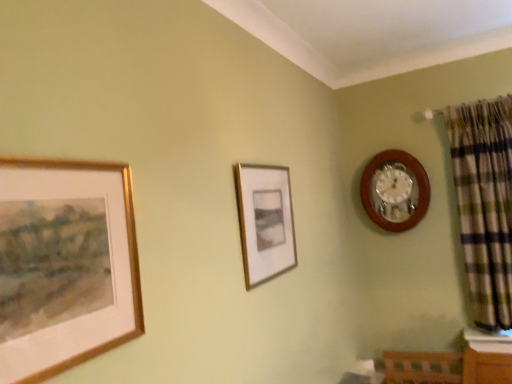
Where is `matte gold picture frame at center, the 1th picture frame positioned from the back`? Image resolution: width=512 pixels, height=384 pixels. matte gold picture frame at center, the 1th picture frame positioned from the back is located at coordinates (265, 221).

The image size is (512, 384). Identify the location of wooden wall clock at upper right. (395, 189).

Measure the distance between point (378, 155) and camera.

The depth of point (378, 155) is 8.89 feet.

This screenshot has height=384, width=512. I want to click on green plaid fabric at right, so click(x=484, y=203).

Locate an element on the screen. The height and width of the screenshot is (384, 512). matte gold picture frame at center, arranged as the 2th picture frame when viewed from the front is located at coordinates (265, 221).

Is wooden wall clock at upper right situated inside matte gold picture frame at center, positioned as the second picture frame in left-to-right order, or outside?

wooden wall clock at upper right is located beyond the bounds of matte gold picture frame at center, positioned as the second picture frame in left-to-right order.

Who is more distant, wooden wall clock at upper right or matte gold picture frame at center, marked as the 1th picture frame in a right-to-left arrangement?

Positioned behind is wooden wall clock at upper right.

From the image's perspective, which one is positioned lower, wooden wall clock at upper right or matte gold picture frame at center, marked as the 1th picture frame in a right-to-left arrangement?

matte gold picture frame at center, marked as the 1th picture frame in a right-to-left arrangement.

From a real-world perspective, is wooden wall clock at upper right positioned over matte gold picture frame at center, marked as the 1th picture frame in a right-to-left arrangement, based on gravity?

Correct, in the physical world, wooden wall clock at upper right is higher than matte gold picture frame at center, marked as the 1th picture frame in a right-to-left arrangement.

How different are the orientations of wooden wall clock at upper right and green plaid fabric at right in degrees?

There is a 0.973-degree angle between the facing directions of wooden wall clock at upper right and green plaid fabric at right.

Considering the positions of objects wooden wall clock at upper right and green plaid fabric at right in the image provided, who is behind, wooden wall clock at upper right or green plaid fabric at right?

wooden wall clock at upper right is more distant.

Would you consider wooden wall clock at upper right to be distant from green plaid fabric at right?

They are positioned close to each other.

From a real-world perspective, is matte gold picture frame at center, marked as the 1th picture frame in a right-to-left arrangement, on top of wooden wall clock at upper right?

No, from a real-world perspective, matte gold picture frame at center, marked as the 1th picture frame in a right-to-left arrangement, is not on top of wooden wall clock at upper right.

Starting from the wooden wall clock at upper right, which picture frame is the 1st one in front? Please provide its 2D coordinates.

[(265, 221)]

Based on the photo, from the image's perspective, which is below, matte gold picture frame at center, positioned as the second picture frame in left-to-right order, or wooden wall clock at upper right?

matte gold picture frame at center, positioned as the second picture frame in left-to-right order, is shown below in the image.

Does matte gold picture frame at center, arranged as the 2th picture frame when viewed from the front, touch wooden wall clock at upper right?

No.

Is wooden wall clock at upper right not close to gold-framed painting at left, the second picture frame in the right-to-left sequence?

wooden wall clock at upper right is positioned a significant distance from gold-framed painting at left, the second picture frame in the right-to-left sequence.

Does wooden wall clock at upper right contain gold-framed painting at left, which is the second picture frame from back to front?

No, gold-framed painting at left, which is the second picture frame from back to front, is not inside wooden wall clock at upper right.

Is the depth of wooden wall clock at upper right greater than that of gold-framed painting at left, the 1th picture frame when ordered from left to right?

Yes, it is.

From a real-world perspective, which is physically above, wooden wall clock at upper right or gold-framed painting at left, the 1th picture frame when ordered from left to right?

wooden wall clock at upper right.

Is gold-framed painting at left, which ranks as the 1th picture frame in front-to-back order, behind matte gold picture frame at center, positioned as the second picture frame in left-to-right order?

No, gold-framed painting at left, which ranks as the 1th picture frame in front-to-back order, is in front of matte gold picture frame at center, positioned as the second picture frame in left-to-right order.

Is gold-framed painting at left, the second picture frame in the right-to-left sequence, wider than matte gold picture frame at center, positioned as the second picture frame in left-to-right order?

No, gold-framed painting at left, the second picture frame in the right-to-left sequence, is not wider than matte gold picture frame at center, positioned as the second picture frame in left-to-right order.

Is matte gold picture frame at center, marked as the 1th picture frame in a right-to-left arrangement, inside gold-framed painting at left, which is the second picture frame from back to front?

That's incorrect, matte gold picture frame at center, marked as the 1th picture frame in a right-to-left arrangement, is not inside gold-framed painting at left, which is the second picture frame from back to front.

From the image's perspective, is gold-framed painting at left, the 1th picture frame when ordered from left to right, under matte gold picture frame at center, arranged as the 2th picture frame when viewed from the front?

Indeed, from the image's perspective, gold-framed painting at left, the 1th picture frame when ordered from left to right, is shown beneath matte gold picture frame at center, arranged as the 2th picture frame when viewed from the front.

Would you say green plaid fabric at right is inside or outside gold-framed painting at left, which is the second picture frame from back to front?

green plaid fabric at right exists outside the volume of gold-framed painting at left, which is the second picture frame from back to front.

From the image's perspective, which one is positioned higher, green plaid fabric at right or gold-framed painting at left, the second picture frame in the right-to-left sequence?

green plaid fabric at right.

Is green plaid fabric at right with gold-framed painting at left, the second picture frame in the right-to-left sequence?

They are not placed beside each other.

This screenshot has width=512, height=384. I want to click on curtain below the gold-framed painting at left, the 1th picture frame when ordered from left to right (from a real-world perspective), so click(x=484, y=203).

Considering their positions, is matte gold picture frame at center, the 1th picture frame positioned from the back, located in front of or behind gold-framed painting at left, the second picture frame in the right-to-left sequence?

matte gold picture frame at center, the 1th picture frame positioned from the back, is behind gold-framed painting at left, the second picture frame in the right-to-left sequence.

Based on the photo, is matte gold picture frame at center, positioned as the second picture frame in left-to-right order, bigger than gold-framed painting at left, the 1th picture frame when ordered from left to right?

Correct, matte gold picture frame at center, positioned as the second picture frame in left-to-right order, is larger in size than gold-framed painting at left, the 1th picture frame when ordered from left to right.

Does matte gold picture frame at center, arranged as the 2th picture frame when viewed from the front, appear on the left side of gold-framed painting at left, which ranks as the 1th picture frame in front-to-back order?

In fact, matte gold picture frame at center, arranged as the 2th picture frame when viewed from the front, is to the right of gold-framed painting at left, which ranks as the 1th picture frame in front-to-back order.

Where is `wall clock above the matte gold picture frame at center, arranged as the 2th picture frame when viewed from the front (from the image's perspective)`? The width and height of the screenshot is (512, 384). wall clock above the matte gold picture frame at center, arranged as the 2th picture frame when viewed from the front (from the image's perspective) is located at coordinates (395, 189).

Locate an element on the screen. curtain in front of the wooden wall clock at upper right is located at coordinates (484, 203).

In the scene shown: Based on their spatial positions, is gold-framed painting at left, the second picture frame in the right-to-left sequence, or green plaid fabric at right closer to matte gold picture frame at center, the 1th picture frame positioned from the back?

Among the two, gold-framed painting at left, the second picture frame in the right-to-left sequence, is located nearer to matte gold picture frame at center, the 1th picture frame positioned from the back.

Considering their positions, is matte gold picture frame at center, marked as the 1th picture frame in a right-to-left arrangement, positioned closer to wooden wall clock at upper right than gold-framed painting at left, the second picture frame in the right-to-left sequence?

matte gold picture frame at center, marked as the 1th picture frame in a right-to-left arrangement, is positioned closer to the anchor wooden wall clock at upper right.

Based on their spatial positions, is matte gold picture frame at center, positioned as the second picture frame in left-to-right order, or gold-framed painting at left, the second picture frame in the right-to-left sequence, closer to green plaid fabric at right?

Based on the image, matte gold picture frame at center, positioned as the second picture frame in left-to-right order, appears to be nearer to green plaid fabric at right.

When comparing their distances from matte gold picture frame at center, the 1th picture frame positioned from the back, does gold-framed painting at left, which is the second picture frame from back to front, or wooden wall clock at upper right seem further?

wooden wall clock at upper right lies further to matte gold picture frame at center, the 1th picture frame positioned from the back, than the other object.

From the image, which object appears to be nearer to gold-framed painting at left, the second picture frame in the right-to-left sequence, green plaid fabric at right or matte gold picture frame at center, the 1th picture frame positioned from the back?

matte gold picture frame at center, the 1th picture frame positioned from the back, is closer to gold-framed painting at left, the second picture frame in the right-to-left sequence.

Which object lies further to the anchor point green plaid fabric at right, matte gold picture frame at center, the 1th picture frame positioned from the back, or wooden wall clock at upper right?

matte gold picture frame at center, the 1th picture frame positioned from the back, lies further to green plaid fabric at right than the other object.

Which object lies nearer to the anchor point wooden wall clock at upper right, gold-framed painting at left, which ranks as the 1th picture frame in front-to-back order, or matte gold picture frame at center, the 1th picture frame positioned from the back?

matte gold picture frame at center, the 1th picture frame positioned from the back, lies closer to wooden wall clock at upper right than the other object.

Looking at the image, which one is located closer to wooden wall clock at upper right, green plaid fabric at right or matte gold picture frame at center, marked as the 1th picture frame in a right-to-left arrangement?

green plaid fabric at right.

Image resolution: width=512 pixels, height=384 pixels. What are the coordinates of `curtain between gold-framed painting at left, which ranks as the 1th picture frame in front-to-back order, and wooden wall clock at upper right, along the z-axis` in the screenshot? It's located at (484, 203).

Where is `picture frame between gold-framed painting at left, the 1th picture frame when ordered from left to right, and wooden wall clock at upper right, along the z-axis`? Image resolution: width=512 pixels, height=384 pixels. picture frame between gold-framed painting at left, the 1th picture frame when ordered from left to right, and wooden wall clock at upper right, along the z-axis is located at coordinates (265, 221).

Image resolution: width=512 pixels, height=384 pixels. Find the location of `picture frame between gold-framed painting at left, which is the second picture frame from back to front, and green plaid fabric at right`. picture frame between gold-framed painting at left, which is the second picture frame from back to front, and green plaid fabric at right is located at coordinates (265, 221).

Where is `wall clock between matte gold picture frame at center, marked as the 1th picture frame in a right-to-left arrangement, and green plaid fabric at right from left to right`? This screenshot has width=512, height=384. wall clock between matte gold picture frame at center, marked as the 1th picture frame in a right-to-left arrangement, and green plaid fabric at right from left to right is located at coordinates (395, 189).